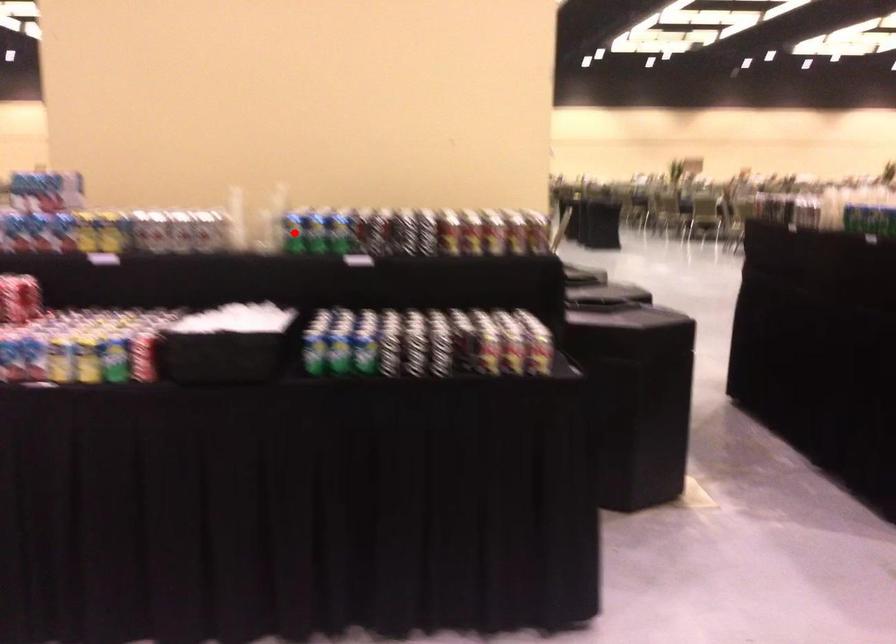
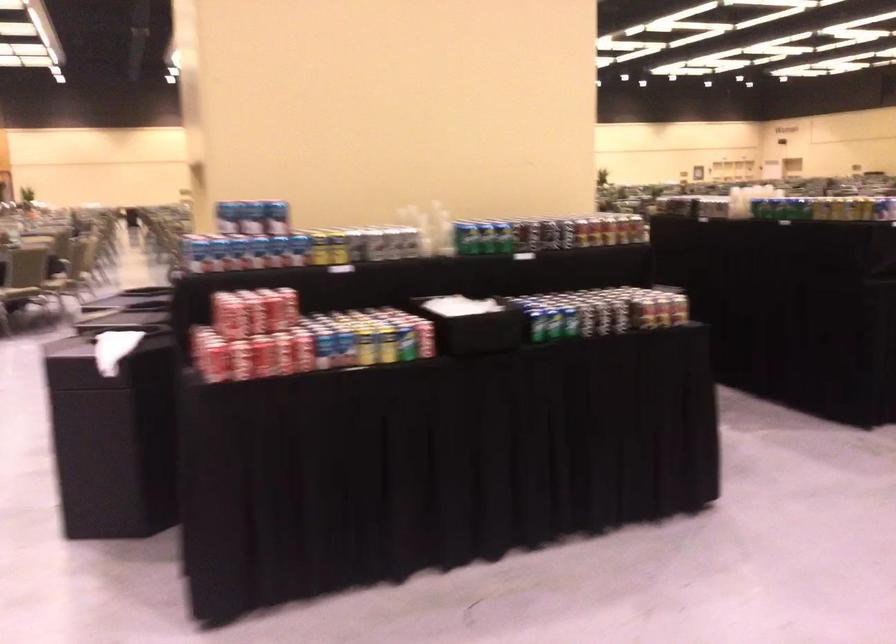
Where in the second image is the point corresponding to the highlighted location from the first image?

(466, 238)